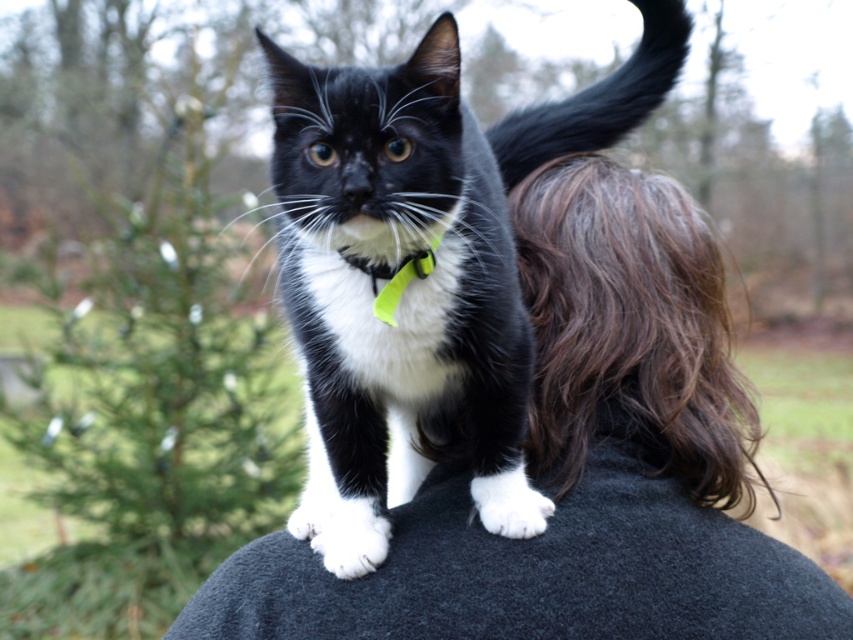
Is black glossy fur cat at center below neon green fabric at center?

Incorrect, black glossy fur cat at center is not positioned below neon green fabric at center.

At what (x,y) coordinates should I click in order to perform the action: click on black glossy fur cat at center. Please return your answer as a coordinate pair (x, y). Image resolution: width=853 pixels, height=640 pixels. Looking at the image, I should click on (426, 276).

Between point (461, 170) and point (376, 312), which one is positioned in front?

Positioned in front is point (376, 312).

You are a GUI agent. You are given a task and a screenshot of the screen. Output one action in this format:
    pyautogui.click(x=<x>, y=<y>)
    Task: Click on the black glossy fur cat at center
    Image resolution: width=853 pixels, height=640 pixels.
    Given the screenshot: What is the action you would take?
    pyautogui.click(x=426, y=276)

Which is above, black glossy fur cat at center or white matte mouth at center?

black glossy fur cat at center

Does black glossy fur cat at center appear on the left side of white matte mouth at center?

In fact, black glossy fur cat at center is to the right of white matte mouth at center.

Which is in front, point (679, 22) or point (386, 227)?

Point (386, 227) is in front.

Find the location of a particular element. black glossy fur cat at center is located at coordinates (426, 276).

Can you confirm if neon green fabric at center is thinner than white matte mouth at center?

No, neon green fabric at center is not thinner than white matte mouth at center.

How distant is neon green fabric at center from white matte mouth at center?

6.34 centimeters

Does point (379, 296) come behind point (366, 220)?

Yes, it is behind point (366, 220).

This screenshot has height=640, width=853. I want to click on neon green fabric at center, so click(393, 276).